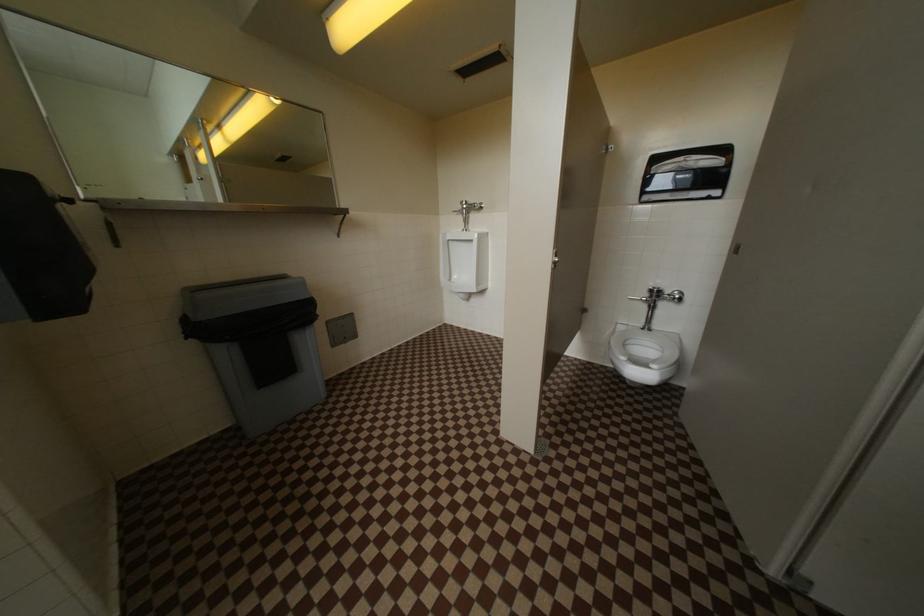
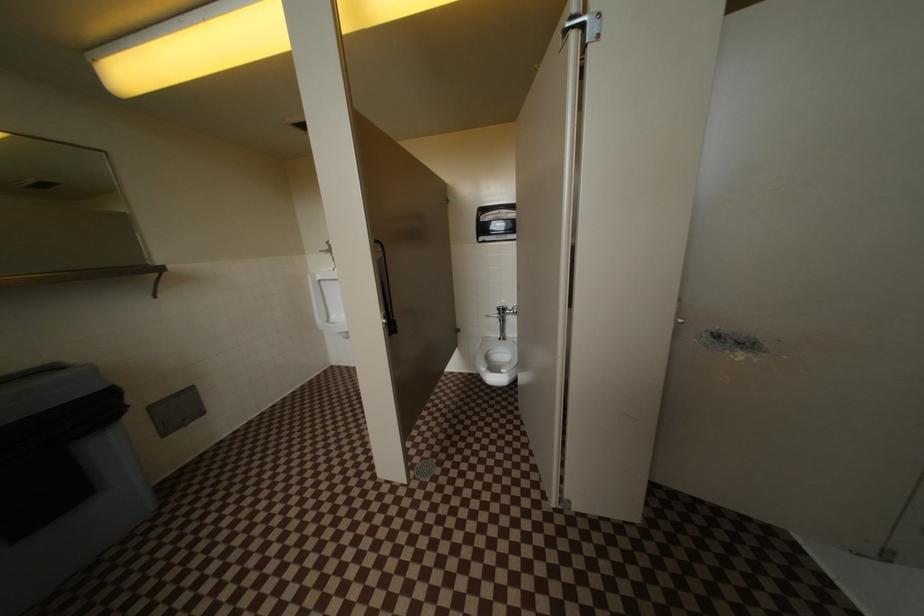
Question: The first image is from the beginning of the video and the second image is from the end. How did the camera likely rotate when shooting the video?

Choices:
 (A) Left
 (B) Right
 (C) Up
 (D) Down

Answer: (B)